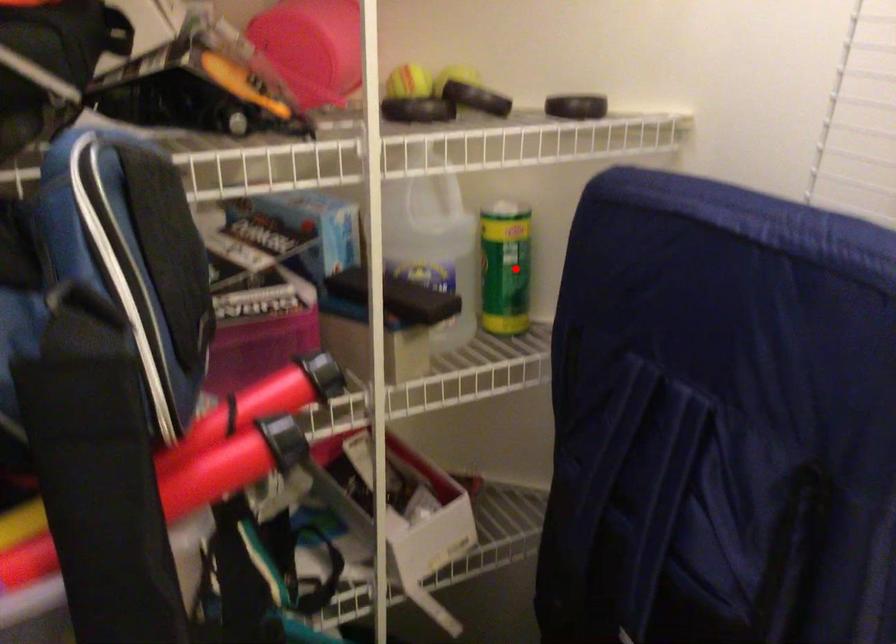
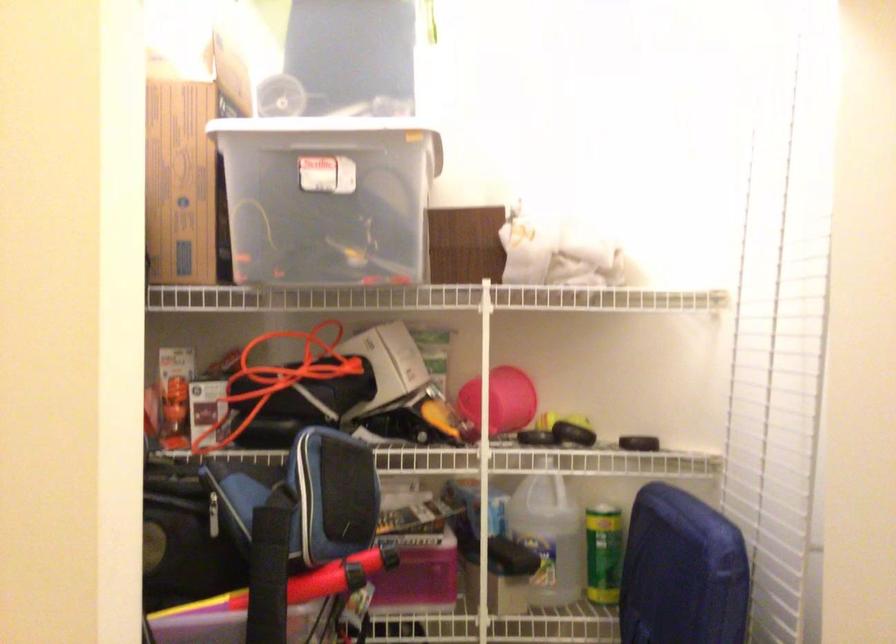
In the second image, find the point that corresponds to the highlighted location in the first image.

(604, 554)